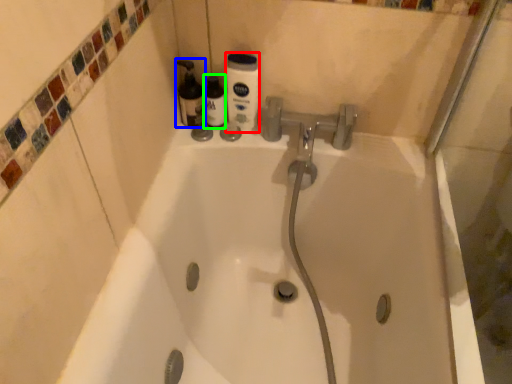
Question: Which is farther away from cleaning product (highlighted by a red box)? cleaning product (highlighted by a blue box) or bottle (highlighted by a green box)?

Choices:
 (A) cleaning product
 (B) bottle

Answer: (A)